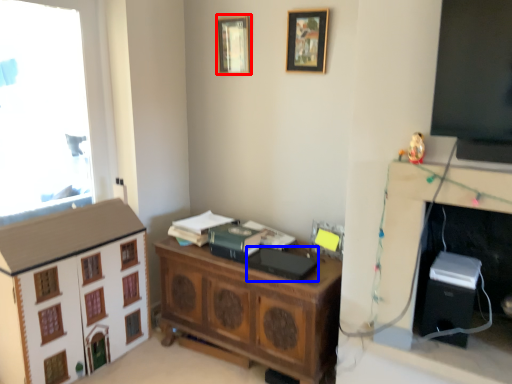
Question: Which point is further to the camera, picture frame (highlighted by a red box) or book (highlighted by a blue box)?

Choices:
 (A) picture frame
 (B) book

Answer: (A)